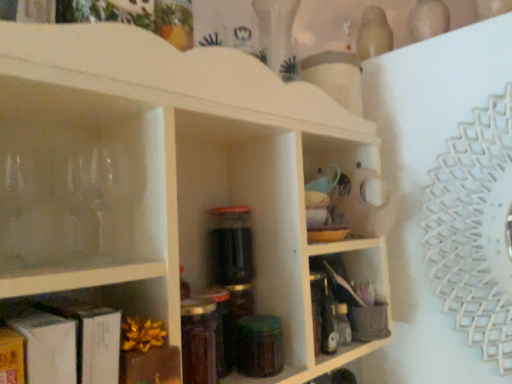
I want to click on translucent plastic bottle at center-right, positioned as the 2th bottle in left-to-right order, so click(x=343, y=324).

What are the coordinates of `translucent glass jar at center, marked as the first bottle in a front-to-back arrangement` in the screenshot? It's located at (199, 341).

Where is `matte plastic container at lower right, placed as the 1th shelf when sorted from back to front`? The height and width of the screenshot is (384, 512). matte plastic container at lower right, placed as the 1th shelf when sorted from back to front is located at coordinates (362, 260).

Which is behind, white matte shelf at center, which is the second shelf from back to front, or translucent glass jar at center, the 1th bottle when ordered from left to right?

translucent glass jar at center, the 1th bottle when ordered from left to right, is behind.

Based on the photo, what's the angular difference between white matte shelf at center, which is the second shelf from back to front, and translucent glass jar at center, the 2th bottle in the right-to-left sequence,'s facing directions?

The angular difference between white matte shelf at center, which is the second shelf from back to front, and translucent glass jar at center, the 2th bottle in the right-to-left sequence, is 6.96 degrees.

Are white matte shelf at center, placed as the second shelf when sorted from front to back, and translucent glass jar at center, the 1th bottle when ordered from left to right, making contact?

No, white matte shelf at center, placed as the second shelf when sorted from front to back, is not with translucent glass jar at center, the 1th bottle when ordered from left to right.

Is point (278, 341) closer to camera compared to point (360, 263)?

Yes.

Which object is thinner, green glass jar at center or matte plastic container at lower right, placed as the 1th shelf when sorted from back to front?

With smaller width is matte plastic container at lower right, placed as the 1th shelf when sorted from back to front.

From the image's perspective, is green glass jar at center below matte plastic container at lower right, which is the 3th shelf from front to back?

Indeed, from the image's perspective, green glass jar at center is shown beneath matte plastic container at lower right, which is the 3th shelf from front to back.

How different are the orientations of green glass jar at center and matte plastic container at lower right, which is the 3th shelf from front to back, in degrees?

0.821 degrees.

Identify the location of shelf located on the right of white matte shelf at center, placed as the second shelf when sorted from front to back. (362, 260).

Is white matte shelf at center, placed as the second shelf when sorted from front to back, facing towards matte plastic container at lower right, placed as the 1th shelf when sorted from back to front?

Yes, white matte shelf at center, placed as the second shelf when sorted from front to back, faces towards matte plastic container at lower right, placed as the 1th shelf when sorted from back to front.

Can you confirm if white matte shelf at center, which is the second shelf from back to front, is wider than matte plastic container at lower right, placed as the 1th shelf when sorted from back to front?

Correct, the width of white matte shelf at center, which is the second shelf from back to front, exceeds that of matte plastic container at lower right, placed as the 1th shelf when sorted from back to front.

From the image's perspective, which is below, white matte shelf at center, which is the second shelf from back to front, or matte plastic container at lower right, placed as the 1th shelf when sorted from back to front?

matte plastic container at lower right, placed as the 1th shelf when sorted from back to front, appears lower in the image.

Based on the photo, between green glass jar at center and white matte shelf at center, placed as the second shelf when sorted from front to back, which one has larger size?

white matte shelf at center, placed as the second shelf when sorted from front to back, is bigger.

Considering the sizes of objects green glass jar at center and white matte shelf at center, which is the second shelf from back to front, in the image provided, who is shorter, green glass jar at center or white matte shelf at center, which is the second shelf from back to front,?

With less height is green glass jar at center.

Which of these two, green glass jar at center or white matte shelf at center, which is the second shelf from back to front, is wider?

With larger width is white matte shelf at center, which is the second shelf from back to front.

Is green glass jar at center turned away from white matte shelf at center, placed as the second shelf when sorted from front to back?

Yes, green glass jar at center's orientation is away from white matte shelf at center, placed as the second shelf when sorted from front to back.

From the image's perspective, is green glass jar at center under matte brown book at lower left, acting as the first shelf starting from the front?

Indeed, from the image's perspective, green glass jar at center is shown beneath matte brown book at lower left, acting as the first shelf starting from the front.

Considering the positions of points (265, 357) and (134, 340), is point (265, 357) farther from camera compared to point (134, 340)?

That is True.

Considering the sizes of objects green glass jar at center and matte brown book at lower left, acting as the first shelf starting from the front, in the image provided, who is shorter, green glass jar at center or matte brown book at lower left, acting as the first shelf starting from the front,?

Standing shorter between the two is green glass jar at center.

Are matte brown book at lower left, the third shelf viewed from the back, and translucent plastic bottle at center-right, the 2th bottle viewed from the front, beside each other?

There is a gap between matte brown book at lower left, the third shelf viewed from the back, and translucent plastic bottle at center-right, the 2th bottle viewed from the front.

From the image's perspective, which is above, matte brown book at lower left, acting as the first shelf starting from the front, or translucent plastic bottle at center-right, positioned as the 2th bottle in left-to-right order?

matte brown book at lower left, acting as the first shelf starting from the front.

Considering the points (106, 364) and (340, 334), which point is in front, point (106, 364) or point (340, 334)?

Point (106, 364)

From their relative heights in the image, would you say matte brown book at lower left, the third shelf viewed from the back, is taller or shorter than translucent plastic bottle at center-right, the 2th bottle viewed from the front?

In the image, matte brown book at lower left, the third shelf viewed from the back, appears to be taller than translucent plastic bottle at center-right, the 2th bottle viewed from the front.

Is translucent glass jar at center, marked as the first bottle in a front-to-back arrangement, placed right next to green glass jar at center?

Yes, translucent glass jar at center, marked as the first bottle in a front-to-back arrangement, is next to green glass jar at center.

Which object is wider, translucent glass jar at center, the 1th bottle when ordered from left to right, or green glass jar at center?

Wider between the two is green glass jar at center.

From the picture: Is translucent glass jar at center, marked as the first bottle in a front-to-back arrangement, positioned with its back to green glass jar at center?

No.

How many degrees apart are the facing directions of translucent glass jar at center, marked as the first bottle in a front-to-back arrangement, and green glass jar at center?

The angle between the facing direction of translucent glass jar at center, marked as the first bottle in a front-to-back arrangement, and the facing direction of green glass jar at center is 3.57 degrees.

From a real-world perspective, starting from the translucent glass jar at center, marked as the second bottle in a back-to-front arrangement, which shelf is the 3rd one vertically above it? Please provide its 2D coordinates.

[(166, 175)]

Identify the location of glass jar below the matte plastic container at lower right, placed as the 1th shelf when sorted from back to front (from the image's perspective). (259, 346).

Estimate the real-world distances between objects in this image. Which object is further from matte brown book at lower left, acting as the first shelf starting from the front, translucent glass jar at center, the 2th bottle in the right-to-left sequence, or matte plastic container at lower right, which is the 3th shelf from front to back?

Among the two, matte plastic container at lower right, which is the 3th shelf from front to back, is located further to matte brown book at lower left, acting as the first shelf starting from the front.

Looking at the image, which one is located closer to white matte shelf at center, placed as the second shelf when sorted from front to back, matte plastic container at lower right, placed as the 1th shelf when sorted from back to front, or translucent plastic bottle at center-right, placed as the 1th bottle when sorted from right to left?

matte plastic container at lower right, placed as the 1th shelf when sorted from back to front, lies closer to white matte shelf at center, placed as the second shelf when sorted from front to back, than the other object.

When comparing their distances from translucent plastic bottle at center-right, positioned as the 2th bottle in left-to-right order, does white matte shelf at center, which is the second shelf from back to front, or matte plastic container at lower right, placed as the 1th shelf when sorted from back to front, seem further?

white matte shelf at center, which is the second shelf from back to front, lies further to translucent plastic bottle at center-right, positioned as the 2th bottle in left-to-right order, than the other object.

Considering their positions, is matte plastic container at lower right, placed as the 1th shelf when sorted from back to front, positioned closer to green glass jar at center than translucent glass jar at center, marked as the second bottle in a back-to-front arrangement?

translucent glass jar at center, marked as the second bottle in a back-to-front arrangement.

Considering their positions, is matte plastic container at lower right, which is the 3th shelf from front to back, positioned further to translucent glass jar at center, the 1th bottle when ordered from left to right, than white matte shelf at center, which is the second shelf from back to front?

matte plastic container at lower right, which is the 3th shelf from front to back.

Based on their spatial positions, is matte brown book at lower left, the third shelf viewed from the back, or matte plastic container at lower right, placed as the 1th shelf when sorted from back to front, closer to white matte shelf at center, which is the second shelf from back to front?

matte brown book at lower left, the third shelf viewed from the back.

From the image, which object appears to be farther from matte plastic container at lower right, placed as the 1th shelf when sorted from back to front, translucent glass jar at center, marked as the second bottle in a back-to-front arrangement, or white matte shelf at center, which is the second shelf from back to front?

translucent glass jar at center, marked as the second bottle in a back-to-front arrangement, is positioned further to the anchor matte plastic container at lower right, placed as the 1th shelf when sorted from back to front.

Considering their positions, is matte plastic container at lower right, placed as the 1th shelf when sorted from back to front, positioned closer to translucent plastic bottle at center-right, placed as the 1th bottle when sorted from right to left, than white matte shelf at center, which is the second shelf from back to front?

The object closer to translucent plastic bottle at center-right, placed as the 1th bottle when sorted from right to left, is matte plastic container at lower right, placed as the 1th shelf when sorted from back to front.

The height and width of the screenshot is (384, 512). Find the location of `bottle positioned between white matte shelf at center, which is the second shelf from back to front, and matte plastic container at lower right, placed as the 1th shelf when sorted from back to front, from near to far`. bottle positioned between white matte shelf at center, which is the second shelf from back to front, and matte plastic container at lower right, placed as the 1th shelf when sorted from back to front, from near to far is located at coordinates (199, 341).

The height and width of the screenshot is (384, 512). In order to click on bottle positioned between matte brown book at lower left, the third shelf viewed from the back, and translucent plastic bottle at center-right, the 2th bottle viewed from the front, from near to far in this screenshot , I will do `click(199, 341)`.

Identify the location of bottle located between white matte shelf at center, which is the second shelf from back to front, and green glass jar at center in the depth direction. (199, 341).

The height and width of the screenshot is (384, 512). I want to click on glass jar located between matte brown book at lower left, the third shelf viewed from the back, and translucent plastic bottle at center-right, placed as the 1th bottle when sorted from right to left, in the depth direction, so click(259, 346).